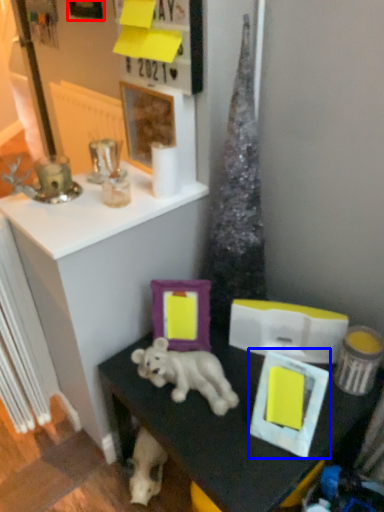
Question: Which object appears closest to the camera in this image, picture frame (highlighted by a red box) or picture frame (highlighted by a blue box)?

Choices:
 (A) picture frame
 (B) picture frame

Answer: (B)